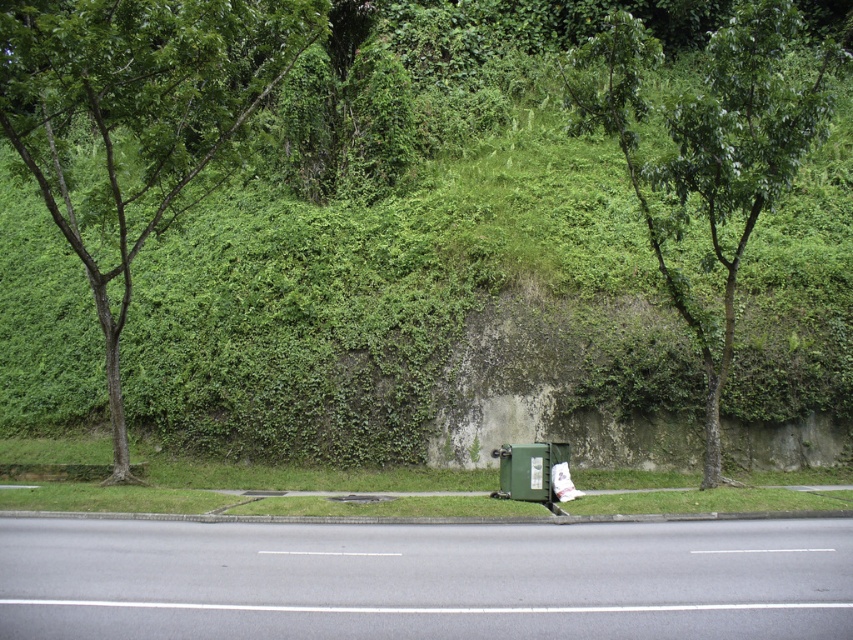
In the scene shown: You are standing on the road and looking towards the green leafy hillside at center and the green leafy tree at left. Which object is higher up in the scene?

The green leafy hillside at center is located above the green leafy tree at left, so it is higher up in the scene.

You are standing on the road and want to walk to the green leafy tree at left. Which direction should you walk to get closer to it first, towards the green leafy hillside at center or away from it?

You should walk towards the green leafy hillside at center to get closer to the green leafy tree at left first, since the hillside is closer to you than the tree.

You are a gardener who needs to water both the green leafy tree at left and the green leafy tree at center. If your watering can holds enough water for 10 meters of travel, can you water both trees without refilling?

The distance between the green leafy tree at left and the green leafy tree at center is 8.88 meters. Since the watering can holds enough for 10 meters, you can water both trees without needing to refill.